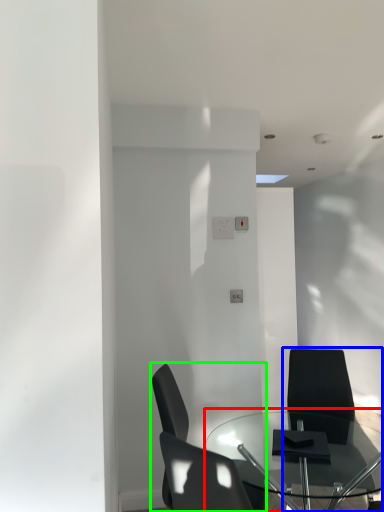
Question: Which object is positioned farthest from table (highlighted by a red box)? Select from chair (highlighted by a blue box) and chair (highlighted by a green box).

Choices:
 (A) chair
 (B) chair

Answer: (B)